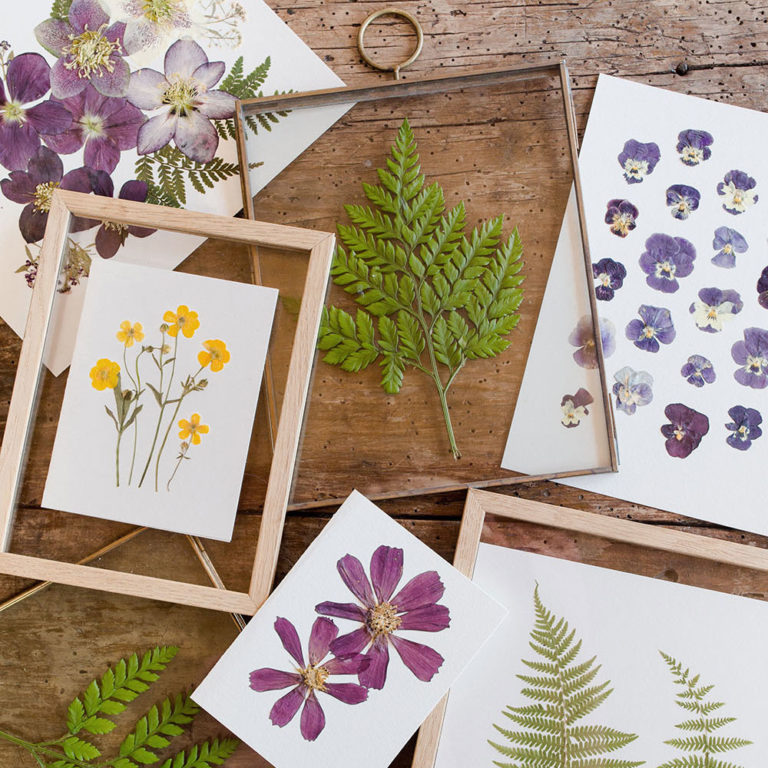
Locate an element on the screen. hook to hang on wall is located at coordinates (401, 61).